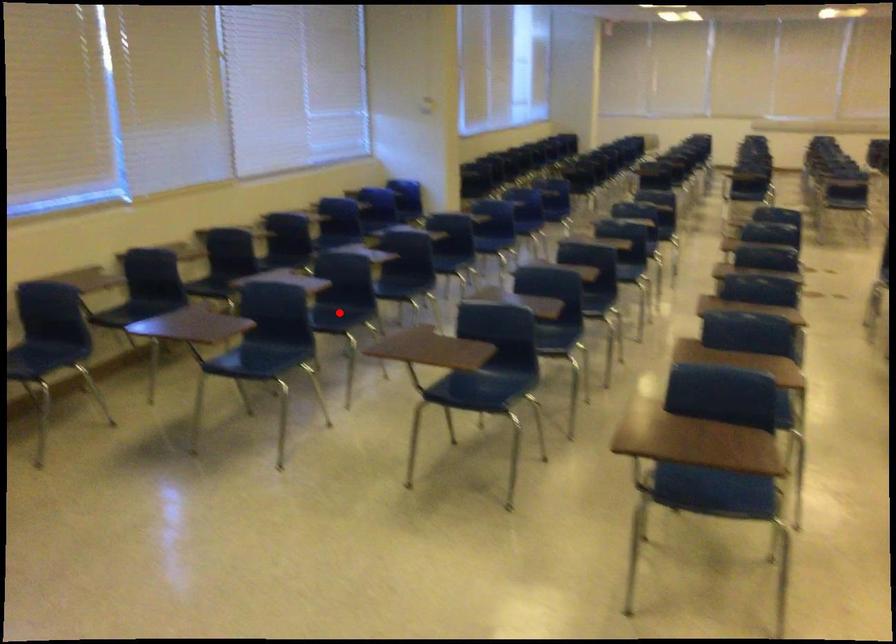
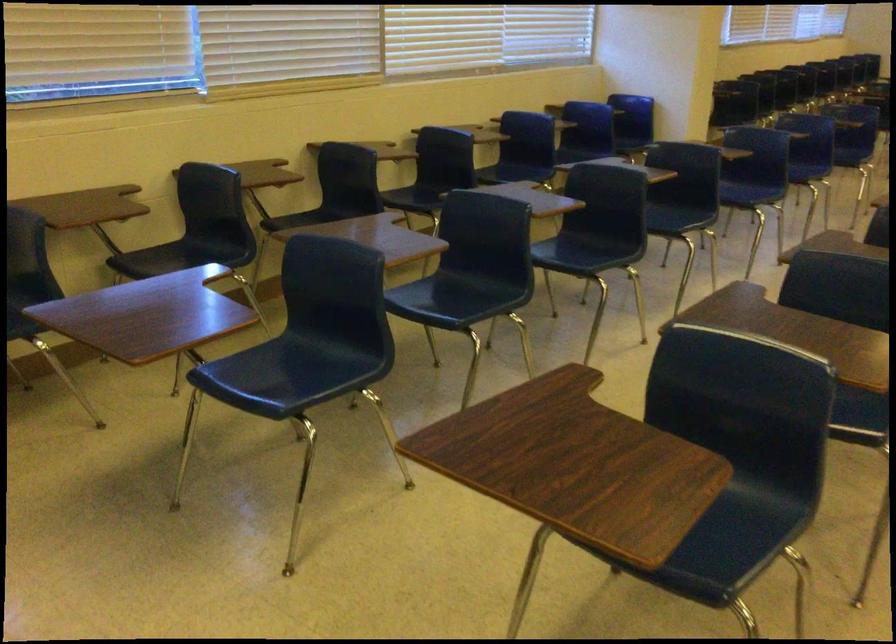
Question: I am providing you with two images of the same scene from different viewpoints. Image1 has a red point marked. In image2, the corresponding 3D location appears at what relative position? Reply with the corresponding letter.

Choices:
 (A) Closer
 (B) Farther

Answer: (A)